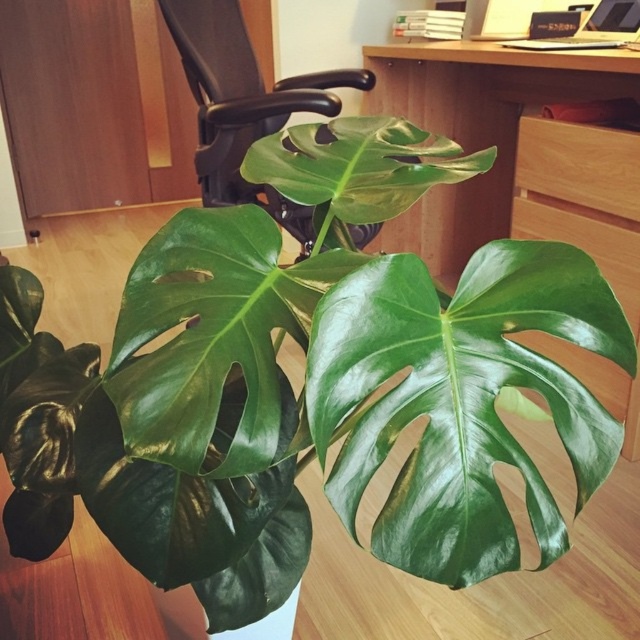
What do you see at coordinates (461, 400) in the screenshot? This screenshot has height=640, width=640. I see `green shiny leaf at center` at bounding box center [461, 400].

Which is in front, point (472, 467) or point (632, 150)?

Point (472, 467) is more forward.

Between point (388, 499) and point (554, 132), which one is positioned behind?

Positioned behind is point (554, 132).

Find the location of `green shiny leaf at center`. green shiny leaf at center is located at coordinates tap(461, 400).

Image resolution: width=640 pixels, height=640 pixels. What are the coordinates of `green glossy leaf at center` in the screenshot? It's located at (211, 333).

Is point (138, 456) less distant than point (444, 129)?

Yes, point (138, 456) is in front of point (444, 129).

Locate an element on the screen. The height and width of the screenshot is (640, 640). green glossy leaf at center is located at coordinates (211, 333).

Which of these two, green shiny leaf at center or black leather swivel chair at center, stands taller?

Standing taller between the two is black leather swivel chair at center.

Image resolution: width=640 pixels, height=640 pixels. I want to click on green shiny leaf at center, so click(x=461, y=400).